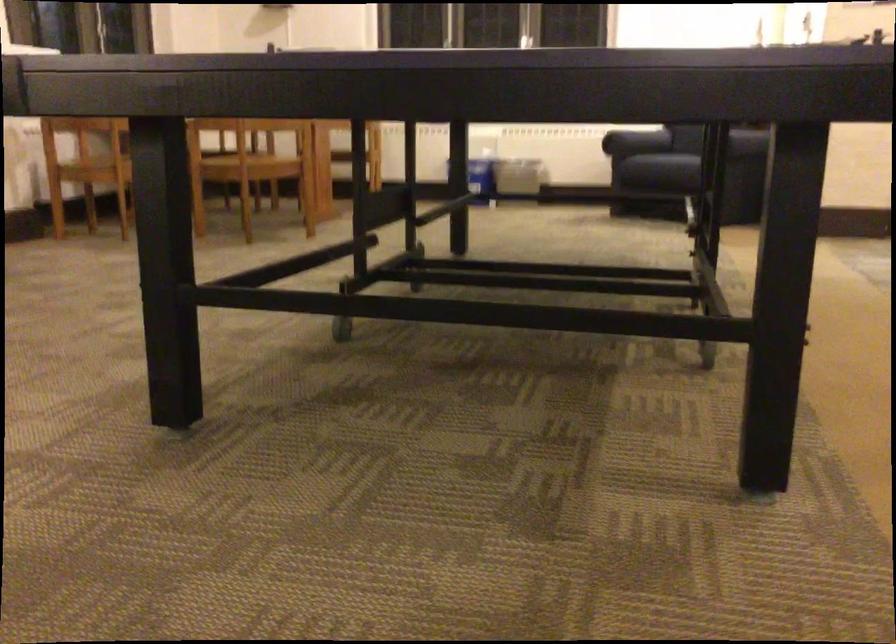
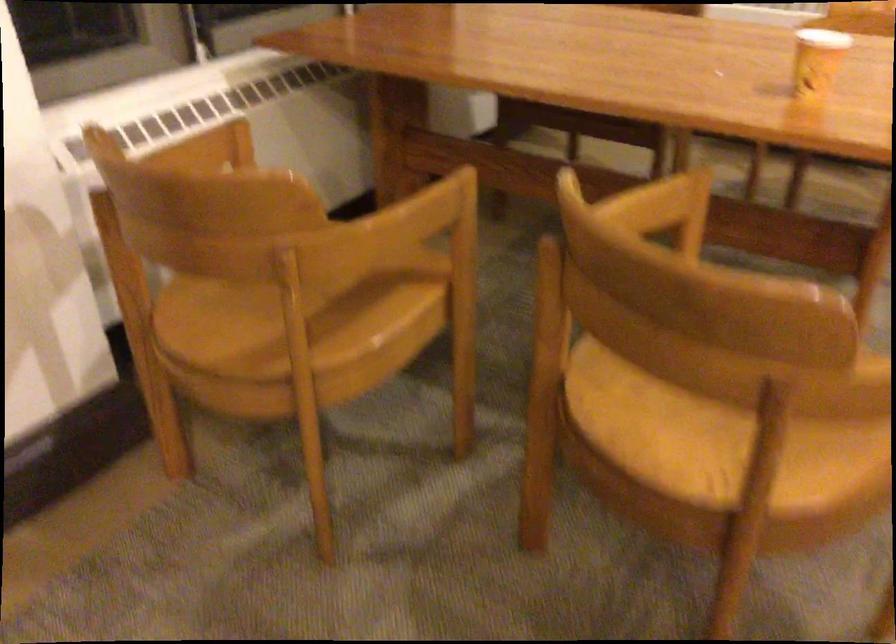
From the picture: What movement of the cameraman would produce the second image?

The cameraman moved toward left, forward.